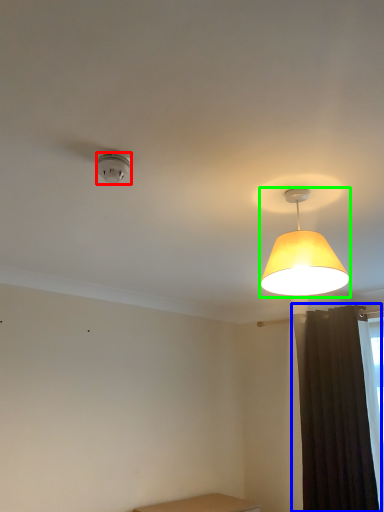
Question: Which is farther away from lamp (highlighted by a red box)? curtain (highlighted by a blue box) or lamp (highlighted by a green box)?

Choices:
 (A) curtain
 (B) lamp

Answer: (A)